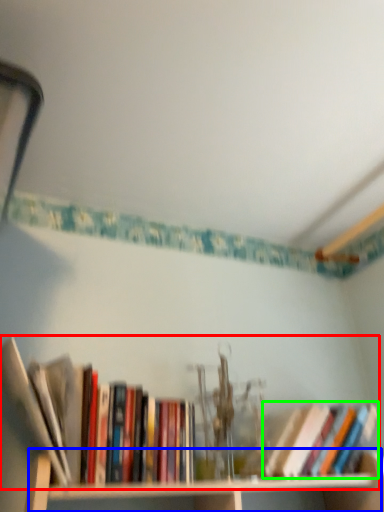
Question: Which object is the farthest from book (highlighted by a red box)? Choose among these: cabinet (highlighted by a blue box) or book (highlighted by a green box).

Choices:
 (A) cabinet
 (B) book

Answer: (B)